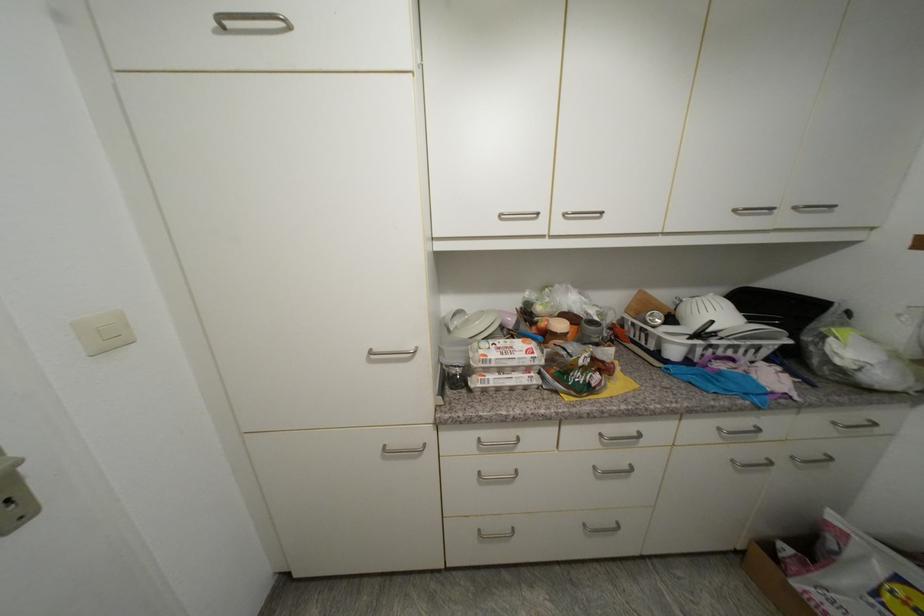
I want to click on white light switch, so click(x=103, y=331).